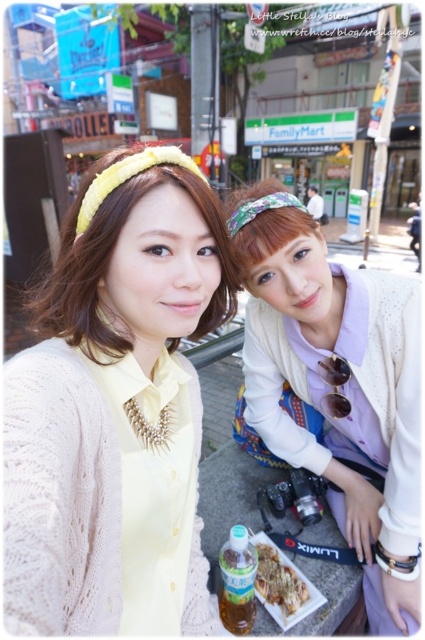
Which is behind, point (193, 308) or point (115, 205)?

Point (193, 308)

Is matte yellow cardigan at center above matte yellow headband at upper center?

Actually, matte yellow cardigan at center is below matte yellow headband at upper center.

You are a GUI agent. You are given a task and a screenshot of the screen. Output one action in this format:
    pyautogui.click(x=<x>, y=<y>)
    Task: Click on the matte yellow cardigan at center
    Image resolution: width=425 pixels, height=640 pixels.
    Given the screenshot: What is the action you would take?
    pyautogui.click(x=104, y=396)

Is white knit cardigan at lower right smaller than translucent plastic bottle at lower center?

Incorrect, white knit cardigan at lower right is not smaller in size than translucent plastic bottle at lower center.

Which is below, white knit cardigan at lower right or translucent plastic bottle at lower center?

translucent plastic bottle at lower center

Between point (299, 300) and point (275, 596), which one is positioned behind?

The point (275, 596) is more distant.

Identify the location of white knit cardigan at lower right. (334, 387).

Can you confirm if matte yellow headband at upper center is smaller than translucent plastic bottle at lower center?

No, matte yellow headband at upper center is not smaller than translucent plastic bottle at lower center.

Does matte yellow headband at upper center appear over translucent plastic bottle at lower center?

Correct, matte yellow headband at upper center is located above translucent plastic bottle at lower center.

Which is in front, point (200, 209) or point (275, 600)?

Point (200, 209) is in front.

At what (x,y) coordinates should I click in order to perform the action: click on matte yellow headband at upper center. Please return your answer as a coordinate pair (x, y). Looking at the image, I should click on (110, 253).